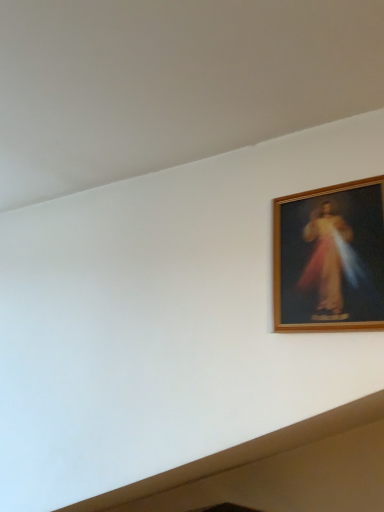
Question: Should I look upward or downward to see wooden frame at upper right?

Choices:
 (A) up
 (B) down

Answer: (B)